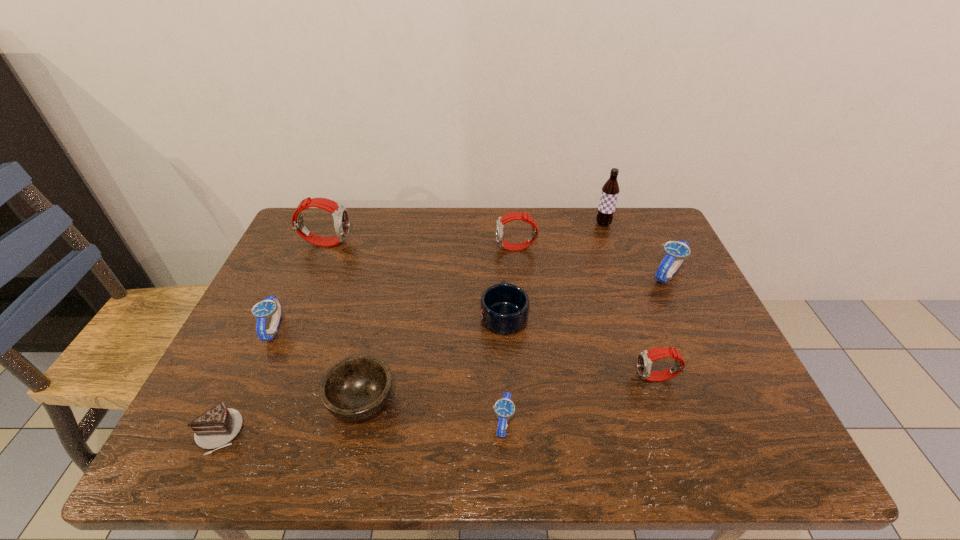
Image resolution: width=960 pixels, height=540 pixels. Find the location of `watch that stands as the fifth closest to the root beer`. watch that stands as the fifth closest to the root beer is located at coordinates (340, 215).

Select which red watch is the third closest to the blue mug. Please provide its 2D coordinates. Your answer should be formatted as a tuple, i.e. [(x, y)], where the tuple contains the x and y coordinates of a point satisfying the conditions above.

[(340, 215)]

The width and height of the screenshot is (960, 540). In order to click on red watch that is the third nearest to the nearest watch in this screenshot , I will do `click(340, 215)`.

Select which blue watch is the closest to the brown bowl. Please provide its 2D coordinates. Your answer should be formatted as a tuple, i.e. [(x, y)], where the tuple contains the x and y coordinates of a point satisfying the conditions above.

[(270, 306)]

Where is `blue watch that is the third closest to the chocolate cake`? blue watch that is the third closest to the chocolate cake is located at coordinates (675, 252).

Where is `vacant region that satisfies the following two spatial constraints: 1. with the handle on the side of the blue mug; 2. on the right side of the farthest blue watch`? The image size is (960, 540). vacant region that satisfies the following two spatial constraints: 1. with the handle on the side of the blue mug; 2. on the right side of the farthest blue watch is located at coordinates (502, 274).

I want to click on vacant space that satisfies the following two spatial constraints: 1. on the front side of the brown bowl; 2. on the right side of the second nearest blue watch, so click(240, 401).

You are a GUI agent. You are given a task and a screenshot of the screen. Output one action in this format:
    pyautogui.click(x=<x>, y=<y>)
    Task: Click on the blank area in the image that satisfies the following two spatial constraints: 1. on the face of the second biggest red watch; 2. on the front side of the nearest watch
    
    Given the screenshot: What is the action you would take?
    pyautogui.click(x=533, y=422)

Identify the location of vacant region that satisfies the following two spatial constraints: 1. on the face of the tallest watch; 2. on the front side of the chocolate cake. This screenshot has width=960, height=540. (246, 433).